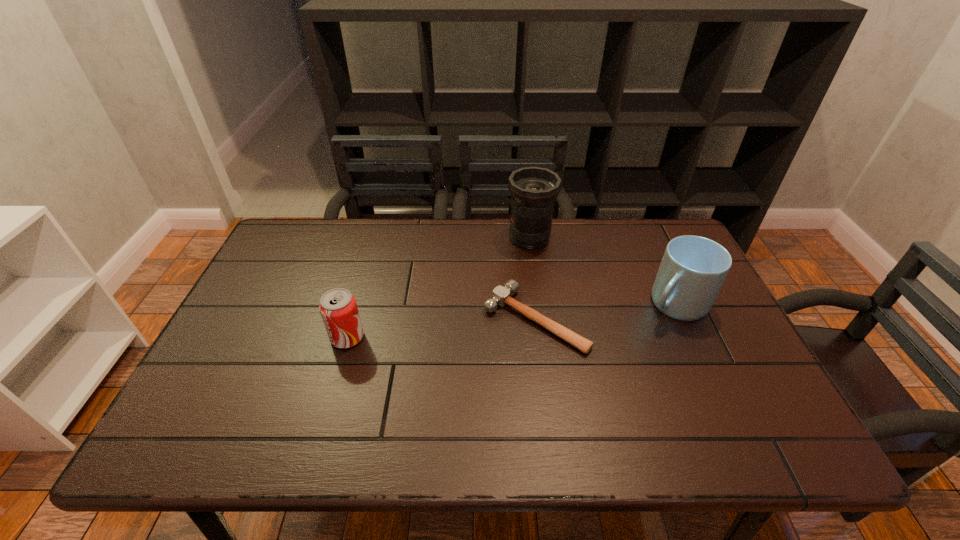
You are a GUI agent. You are given a task and a screenshot of the screen. Output one action in this format:
    pyautogui.click(x=<x>, y=<y>)
    Task: Click on the farthest object
    The width and height of the screenshot is (960, 540).
    Given the screenshot: What is the action you would take?
    pyautogui.click(x=534, y=189)

At what (x,y) coordinates should I click in order to perform the action: click on telephoto lens. Please return your answer as a coordinate pair (x, y). This screenshot has height=540, width=960. Looking at the image, I should click on (534, 189).

You are a GUI agent. You are given a task and a screenshot of the screen. Output one action in this format:
    pyautogui.click(x=<x>, y=<y>)
    Task: Click on the rightmost object
    
    Given the screenshot: What is the action you would take?
    pyautogui.click(x=693, y=268)

Locate an element on the screen. mug is located at coordinates (693, 268).

This screenshot has height=540, width=960. I want to click on the second shortest object, so coord(338,308).

Where is `the leftmost object`? The height and width of the screenshot is (540, 960). the leftmost object is located at coordinates (338, 308).

This screenshot has width=960, height=540. I want to click on hammer, so click(501, 295).

At what (x,y) coordinates should I click in order to perform the action: click on vacant point located 0.200m on the right of the telephoto lens. Please return your answer as a coordinate pair (x, y). The image size is (960, 540). Looking at the image, I should click on (614, 238).

Find the location of `vacant space located on the left of the mug`. vacant space located on the left of the mug is located at coordinates (617, 304).

I want to click on free region located on the back of the third tallest object, so tap(373, 247).